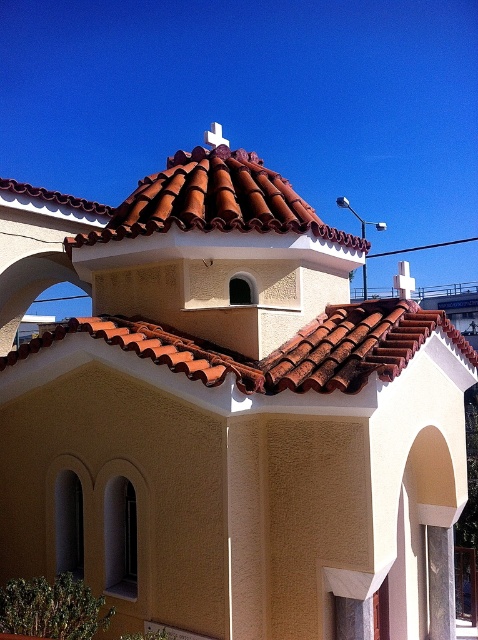
Question: Which of the following is the closest to the observer?

Choices:
 (A) (237, 163)
 (B) (364, 349)

Answer: (B)

Question: Can you confirm if brown clay tiles at center is positioned to the left of brown tile roof at upper center?

Choices:
 (A) no
 (B) yes

Answer: (A)

Question: Can you confirm if brown clay tiles at center is positioned below brown tile roof at upper center?

Choices:
 (A) no
 (B) yes

Answer: (B)

Question: Is brown clay tiles at center thinner than brown tile roof at upper center?

Choices:
 (A) yes
 (B) no

Answer: (A)

Question: Which of the following is the closest to the observer?

Choices:
 (A) brown clay tiles at center
 (B) brown tile roof at upper center

Answer: (A)